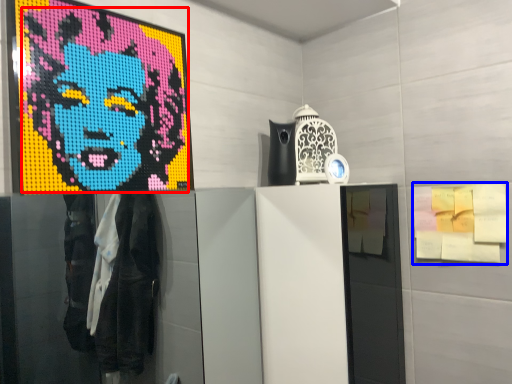
Question: Which object is closer to the camera taking this photo, person (highlighted by a red box) or poster (highlighted by a blue box)?

Choices:
 (A) person
 (B) poster

Answer: (A)